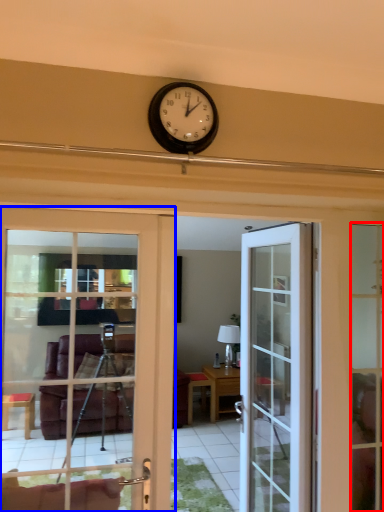
Question: Which of the following is the closest to the observer, window frame (highlighted by a red box) or door (highlighted by a blue box)?

Choices:
 (A) window frame
 (B) door

Answer: (B)